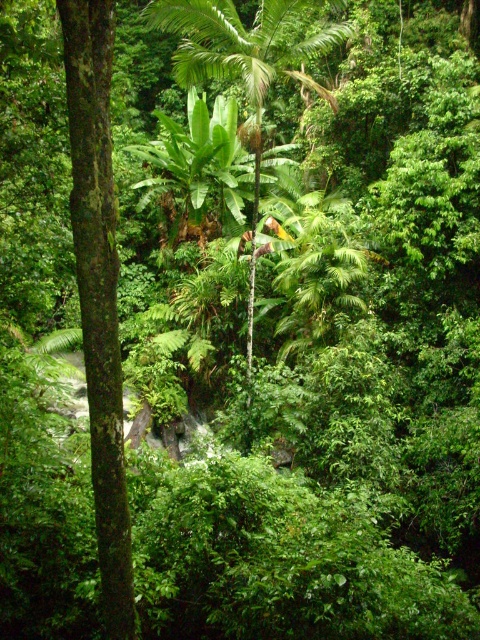
You are navigating through a dense tropical forest and come across a tree trunk on the left side. You notice a specific point marked at coordinates [98,291]. Can you determine what object this point is pointing to?

The point at coordinates [98,291] corresponds to the green rough bark tree at left.

You are a hiker trying to navigate through the dense tropical forest. You see the green rough bark tree at left and the green leafy palm tree at center. Which tree would block your view of the other tree if you are standing between them?

The green rough bark tree at left is in front of the green leafy palm tree at center, so if you are standing between them, the green rough bark tree at left would block your view of the green leafy palm tree at center.

You are a hiker who wants to climb the tallest tree in the forest. Based on the scene, which tree should you choose between the green rough bark tree at left and the green leafy palm tree at center?

The green leafy palm tree at center is taller than the green rough bark tree at left, so you should choose the green leafy palm tree at center to climb as it is the tallest tree available.